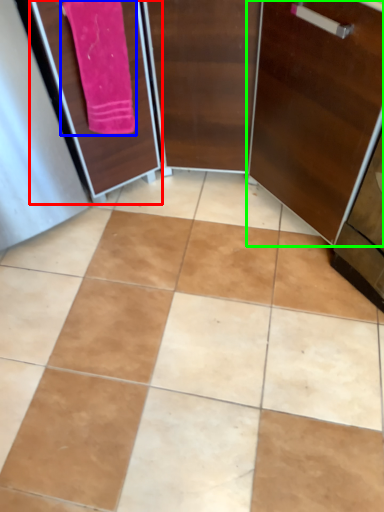
Question: Considering the real-world distances, which object is closest to screen door (highlighted by a red box)? bath towel (highlighted by a blue box) or door (highlighted by a green box).

Choices:
 (A) bath towel
 (B) door

Answer: (A)